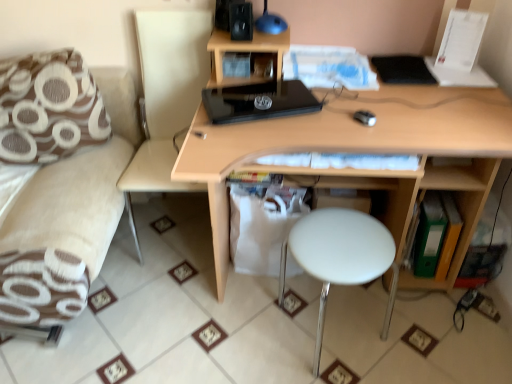
Measure the distance between green plastic folder at lower right and camera.

They are 1.61 meters apart.

What do you see at coordinates (346, 138) in the screenshot? This screenshot has width=512, height=384. I see `light wood desk at center` at bounding box center [346, 138].

Image resolution: width=512 pixels, height=384 pixels. Describe the element at coordinates (60, 185) in the screenshot. I see `brown fabric couch at left` at that location.

You are a GUI agent. You are given a task and a screenshot of the screen. Output one action in this format:
    pyautogui.click(x=<x>, y=<y>)
    Task: Click on the brown fabric pillow at left
    Image resolution: width=512 pixels, height=384 pixels.
    Given the screenshot: What is the action you would take?
    pyautogui.click(x=49, y=108)

You are a GUI agent. You are given a task and a screenshot of the screen. Output one action in this format:
    pyautogui.click(x=<x>, y=<y>)
    Task: Click on the white glossy stool at center
    The image size is (512, 384).
    Given the screenshot: What is the action you would take?
    pyautogui.click(x=340, y=257)

Considering the relative sizes of black matte speaker at upper center and brown fabric pillow at left in the image provided, is black matte speaker at upper center thinner than brown fabric pillow at left?

Yes, black matte speaker at upper center is thinner than brown fabric pillow at left.

Where is `speaker above the brown fabric pillow at left (from a real-world perspective)`? This screenshot has width=512, height=384. speaker above the brown fabric pillow at left (from a real-world perspective) is located at coordinates (241, 21).

From the picture: Is black matte speaker at upper center placed right next to brown fabric pillow at left?

black matte speaker at upper center and brown fabric pillow at left are clearly separated.

In terms of size, does green plastic folder at lower right appear bigger or smaller than brown fabric couch at left?

In the image, green plastic folder at lower right appears to be smaller than brown fabric couch at left.

Image resolution: width=512 pixels, height=384 pixels. Find the location of `furniture that appears on the left of green plastic folder at lower right`. furniture that appears on the left of green plastic folder at lower right is located at coordinates (60, 185).

From a real-world perspective, is green plastic folder at lower right positioned over brown fabric couch at left based on gravity?

Incorrect, from a real-world perspective, green plastic folder at lower right is lower than brown fabric couch at left.

Is point (447, 253) closer or farther from the camera than point (35, 132)?

Clearly, point (447, 253) is more distant from the camera than point (35, 132).

This screenshot has height=384, width=512. I want to click on speaker that is above the light wood desk at center (from the image's perspective), so click(x=241, y=21).

Is light wood desk at center directly adjacent to black matte speaker at upper center?

No.

How many degrees apart are the facing directions of light wood desk at center and black matte speaker at upper center?

0.249 degrees.

Is light wood desk at center in front of or behind beige fabric swivel chair at left in the image?

Clearly, light wood desk at center is in front of beige fabric swivel chair at left.

Is light wood desk at center looking in the opposite direction of beige fabric swivel chair at left?

No, light wood desk at center is not facing away from beige fabric swivel chair at left.

From a real-world perspective, is light wood desk at center positioned under beige fabric swivel chair at left based on gravity?

Indeed, from a real-world perspective, light wood desk at center is positioned beneath beige fabric swivel chair at left.

Considering the points (500, 155) and (209, 68), which point is in front, point (500, 155) or point (209, 68)?

The point (500, 155) is closer.

Looking at this image, between black glossy laptop at center and brown fabric pillow at left, which one appears on the left side from the viewer's perspective?

Positioned to the left is brown fabric pillow at left.

From the image's perspective, would you say black glossy laptop at center is shown under brown fabric pillow at left?

Yes, from the image's perspective, black glossy laptop at center is below brown fabric pillow at left.

Is black glossy laptop at center completely or partially outside of brown fabric pillow at left?

Indeed, black glossy laptop at center is completely outside brown fabric pillow at left.

Find the location of `book that is above the white glossy stool at center (from the image's perspective)`. book that is above the white glossy stool at center (from the image's perspective) is located at coordinates [435, 236].

Can you tell me how much white glossy stool at center and green plastic folder at lower right differ in facing direction?

white glossy stool at center and green plastic folder at lower right are facing 0.719 degrees away from each other.

Can you confirm if white glossy stool at center is bigger than green plastic folder at lower right?

Yes, white glossy stool at center is bigger than green plastic folder at lower right.

Is white glossy stool at center thinner than green plastic folder at lower right?

In fact, white glossy stool at center might be wider than green plastic folder at lower right.

From a real-world perspective, is black glossy laptop at center on black matte speaker at upper center?

Actually, black glossy laptop at center is physically below black matte speaker at upper center in the real world.

Consider the image. Is black glossy laptop at center not near black matte speaker at upper center?

black glossy laptop at center is near black matte speaker at upper center, not far away.

From the image's perspective, is black glossy laptop at center located beneath black matte speaker at upper center?

Yes, from the image's perspective, black glossy laptop at center is below black matte speaker at upper center.

Considering the relative positions of black glossy laptop at center and black matte speaker at upper center in the image provided, is black glossy laptop at center to the left or to the right of black matte speaker at upper center?

black glossy laptop at center is to the right of black matte speaker at upper center.

This screenshot has height=384, width=512. Identify the location of pillow on the left of black matte speaker at upper center. (49, 108).

The width and height of the screenshot is (512, 384). In order to click on book below the brown fabric couch at left (from the image's perspective) in this screenshot , I will do `click(435, 236)`.

Estimate the real-world distances between objects in this image. Which object is further from beige fabric swivel chair at left, brown fabric couch at left or black matte speaker at upper center?

black matte speaker at upper center lies further to beige fabric swivel chair at left than the other object.

Looking at the image, which one is located closer to white glossy stool at center, black matte speaker at upper center or beige fabric swivel chair at left?

beige fabric swivel chair at left is closer to white glossy stool at center.

Looking at the image, which one is located closer to beige fabric swivel chair at left, white glossy stool at center or green plastic folder at lower right?

white glossy stool at center is closer to beige fabric swivel chair at left.

Considering their positions, is black matte speaker at upper center positioned further to white glossy stool at center than light wood desk at center?

black matte speaker at upper center lies further to white glossy stool at center than the other object.

From the image, which object appears to be farther from black glossy laptop at center, brown fabric couch at left or brown fabric pillow at left?

brown fabric couch at left is positioned further to the anchor black glossy laptop at center.

Estimate the real-world distances between objects in this image. Which object is further from white glossy stool at center, black glossy laptop at center or brown fabric pillow at left?

The object further to white glossy stool at center is brown fabric pillow at left.

Based on their spatial positions, is green plastic folder at lower right or brown fabric couch at left further from brown fabric pillow at left?

Among the two, green plastic folder at lower right is located further to brown fabric pillow at left.

From the image, which object appears to be farther from beige fabric swivel chair at left, green plastic folder at lower right or white glossy stool at center?

green plastic folder at lower right is further to beige fabric swivel chair at left.

Find the location of a particular element. This screenshot has height=384, width=512. stool between beige fabric swivel chair at left and light wood desk at center in the horizontal direction is located at coordinates (340, 257).

Where is `laptop between black matte speaker at upper center and green plastic folder at lower right from left to right`? This screenshot has width=512, height=384. laptop between black matte speaker at upper center and green plastic folder at lower right from left to right is located at coordinates click(255, 102).

The image size is (512, 384). What are the coordinates of `stool between light wood desk at center and green plastic folder at lower right along the z-axis` in the screenshot? It's located at (340, 257).

Locate an element on the screen. This screenshot has height=384, width=512. desk between brown fabric couch at left and green plastic folder at lower right is located at coordinates (346, 138).